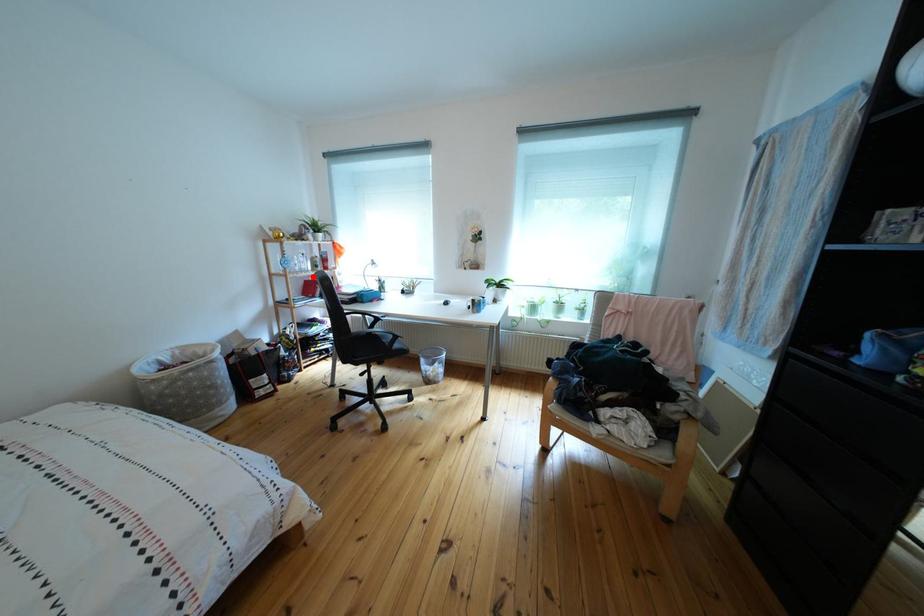
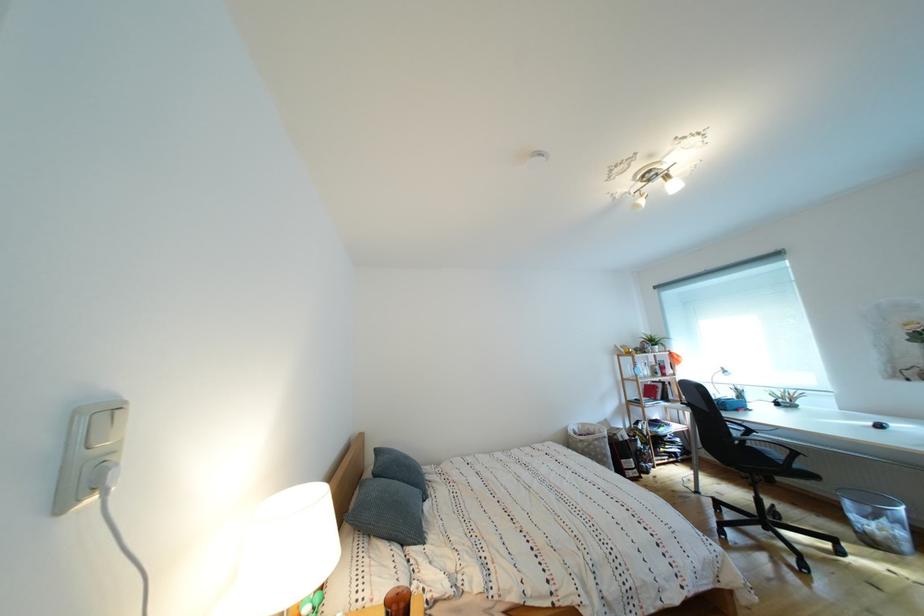
Question: I am providing you with two images of the same scene from different viewpoints. Given a red point in image1, look at the same physical point in image2. Is it:

Choices:
 (A) Closer to the viewpoint
 (B) Farther from the viewpoint

Answer: (B)